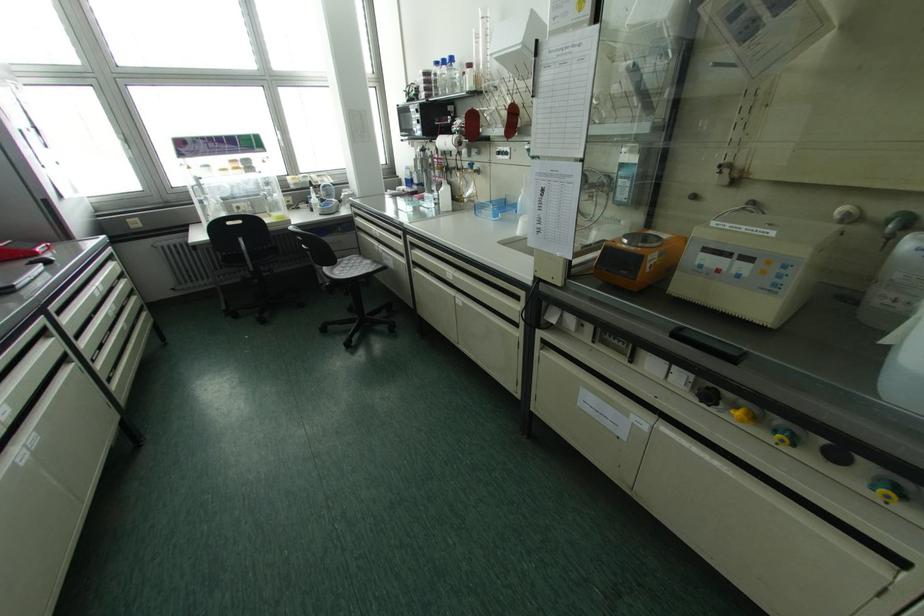
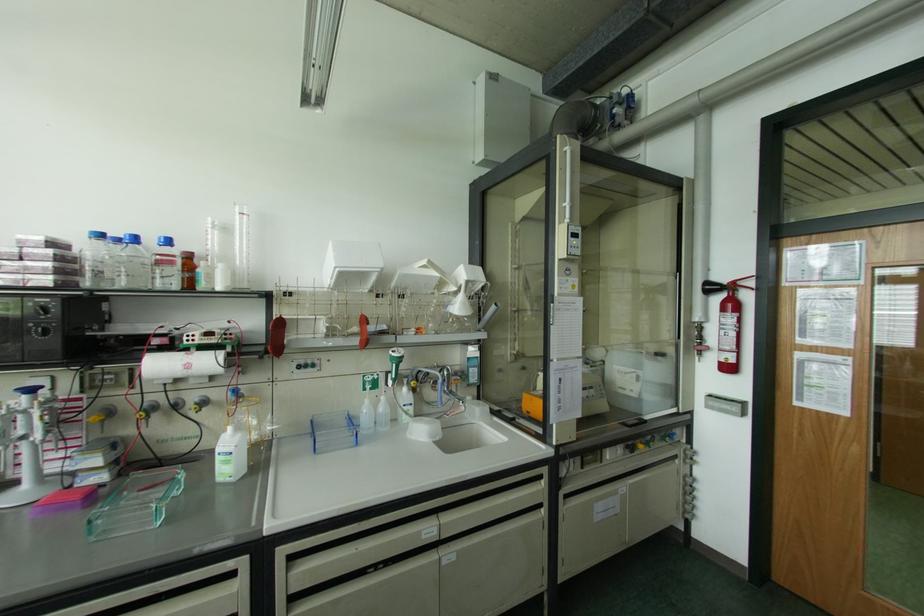
In the second image, find the point that corresponds to pixel 451 172 in the first image.

(148, 416)